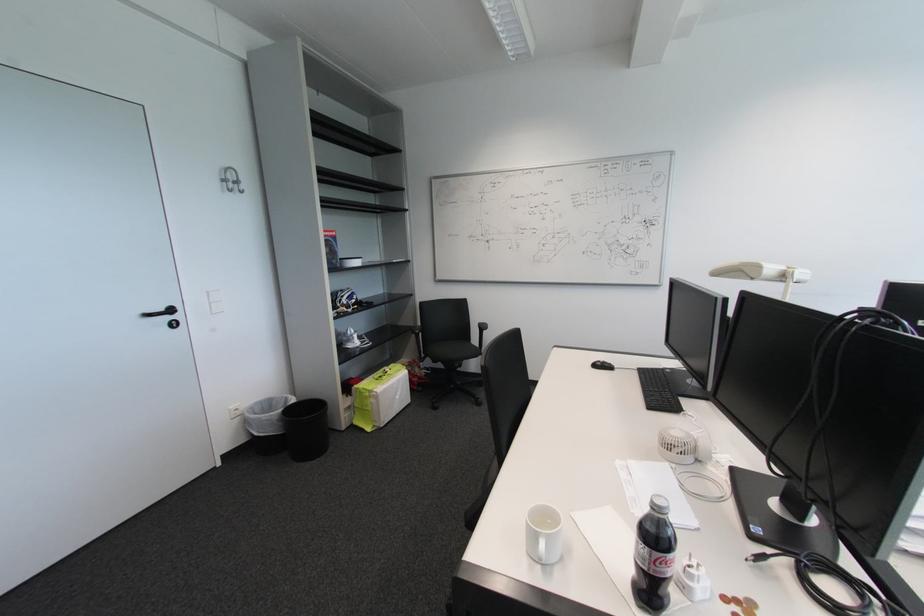
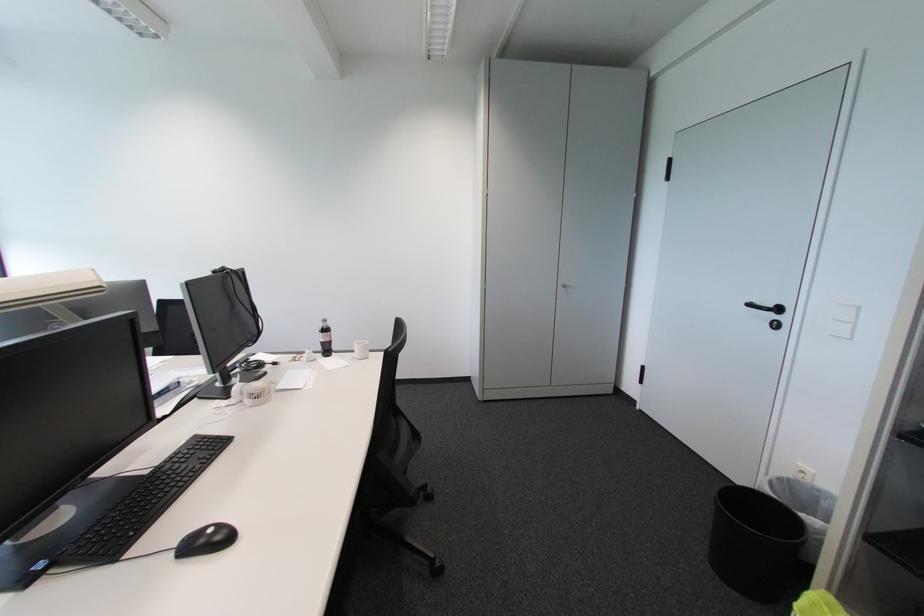
Locate, in the second image, the point that corresponds to point (324, 461) in the first image.

(714, 565)